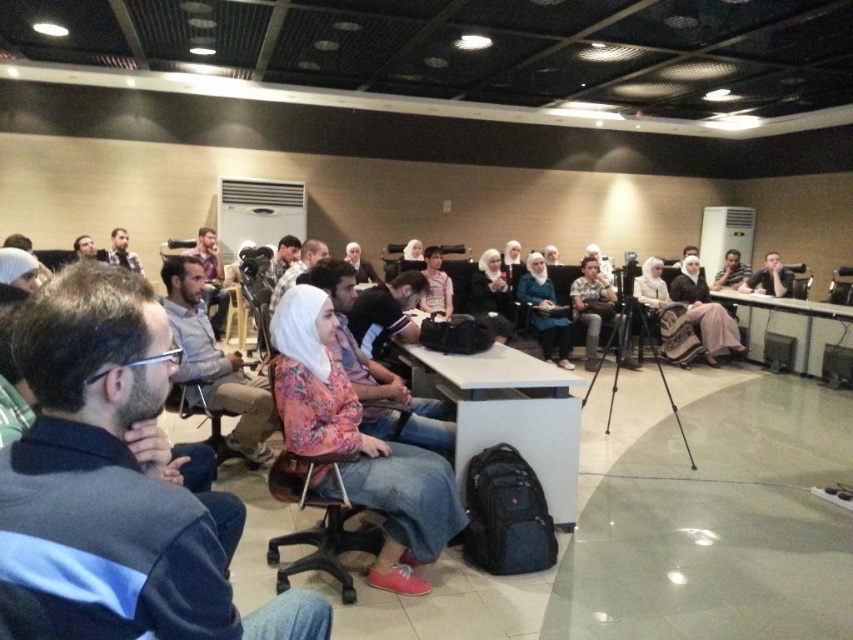
You are an attendee at this conference and want to borrow a laptop charger from someone nearby. You see the floral fabric shirt at center and the matte black laptop at upper right. Which person is closer to you so you can ask them for help?

The floral fabric shirt at center is closer to the viewer than the matte black laptop at upper right, so you should ask the person wearing the floral fabric shirt at center.

You are organizing a photo shoot and need to place the matte black camera at center and the pink fabric shirt at center in a way that they are both visible in the frame. Since the camera is larger, where should you position them to ensure both are fully visible?

Since the matte black camera at center is larger than the pink fabric shirt at center, you should place the matte black camera at center slightly behind or to the side of the pink fabric shirt at center to ensure both fit within the frame without overlapping.

You are attending a conference and want to take a photo of the speaker wearing the pink fabric shirt at center. However, you notice the matte black camera at center is in the way. Is the camera blocking your view of the shirt?

The matte black camera at center is below the pink fabric shirt at center, so it is not blocking the view of the shirt.